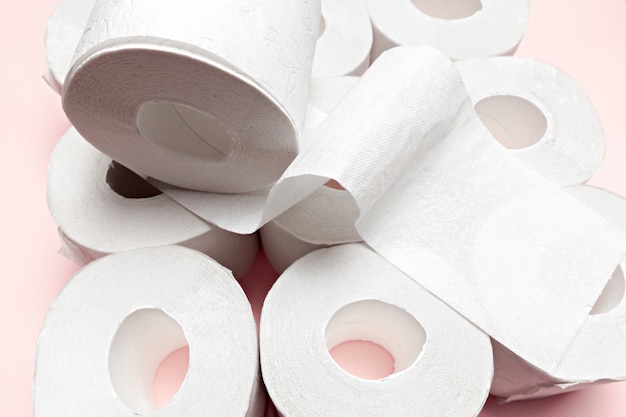
What are the coordinates of `toilet tissue` in the screenshot? It's located at (196, 267), (288, 375), (131, 221), (258, 129), (321, 231), (558, 135), (613, 205), (462, 39), (341, 53).